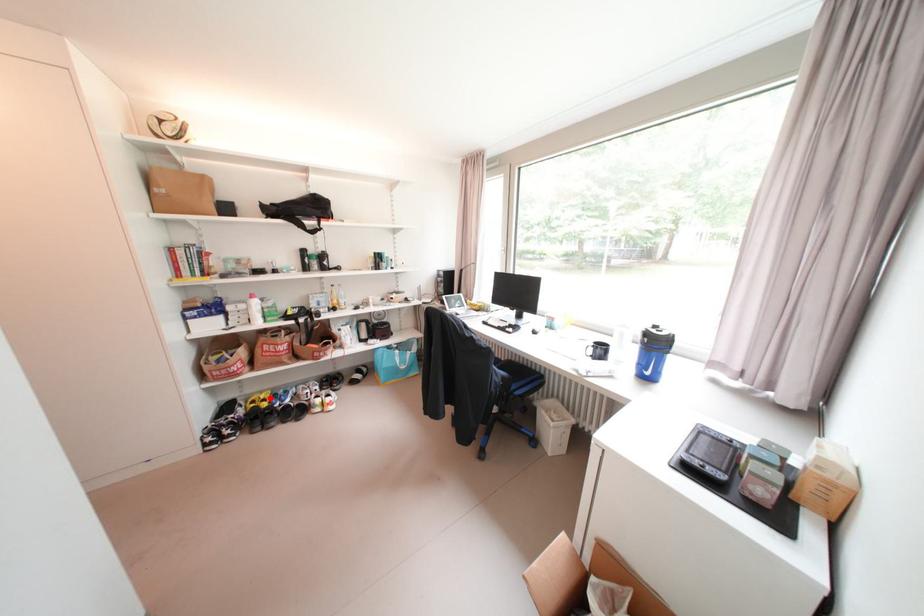
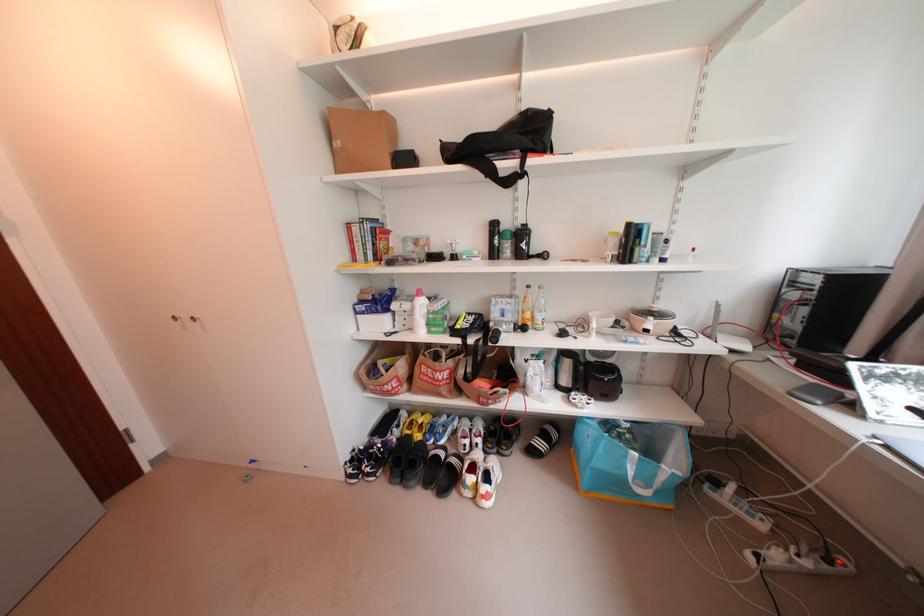
Question: I am providing you with two images of the same scene from different viewpoints. In image1, a red point is highlighted. Considering the same 3D point in image2, which of the following is correct?

Choices:
 (A) It is closer
 (B) It is farther

Answer: (B)